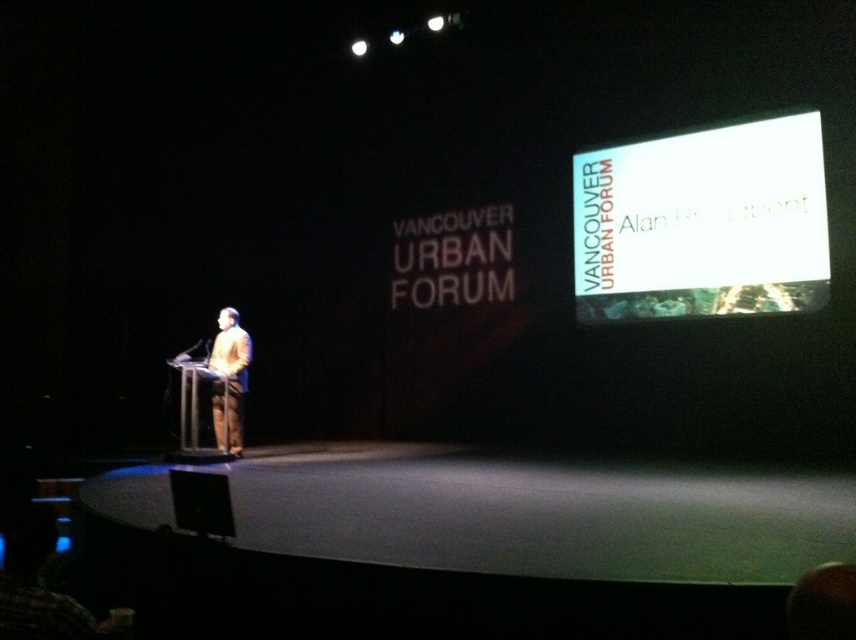
You are an attendee at the Vancouver Urban Forum. You want to take a photo of the speaker but need to ensure the white glossy projection screen at upper right and the matte brown suit at center are both visible in the frame. Given their sizes, which object should you position closer to the camera to include both in the photo?

The white glossy projection screen at upper right is larger than the matte brown suit at center. To include both in the photo, position the white glossy projection screen at upper right closer to the camera since its larger size requires more space in the frame.

You are an attendee at the Vancouver Urban Forum. You see the white glossy projection screen at upper right and the matte brown suit at center. Which object is nearer to you?

The white glossy projection screen at upper right is closer to the viewer than the matte brown suit at center.